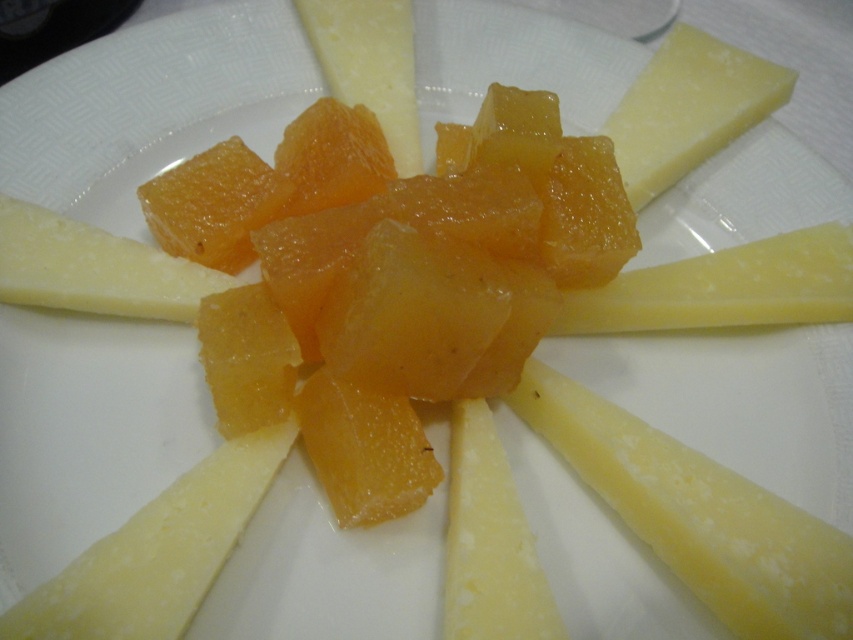
You are a food photographer setting up a shot of this plate. You need to position your camera so that the focal point is exactly at the point marked as point (843, 582). Given that the focal length of your lens is 50mm and the sensor size is 36mm, what is the minimum distance you should place the camera from the plate to ensure the entire scene is in focus?

The minimum distance to place the camera is 34.88 inches because the distance of point (843, 582) from the camera is exactly 34.88 inches, ensuring the focal point is correctly positioned.